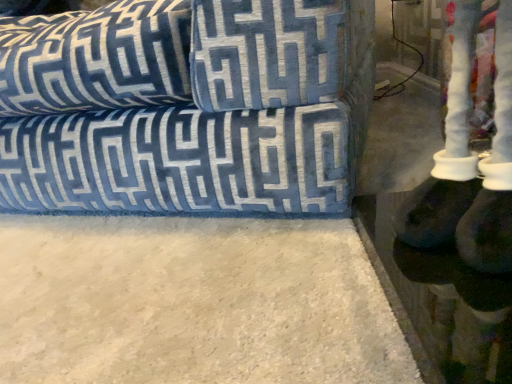
What is the approximate height of blue velvet couch at left?

It is 18.86 inches.

Where is `blue velvet couch at left`? This screenshot has height=384, width=512. blue velvet couch at left is located at coordinates (186, 106).

Image resolution: width=512 pixels, height=384 pixels. Describe the element at coordinates (186, 106) in the screenshot. I see `blue velvet couch at left` at that location.

The width and height of the screenshot is (512, 384). Identify the location of blue velvet couch at left. (186, 106).